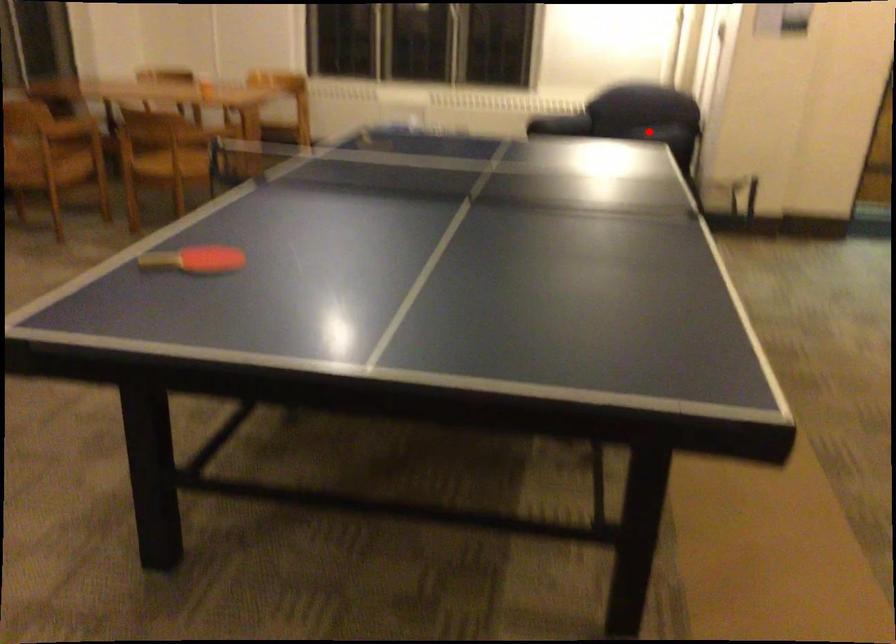
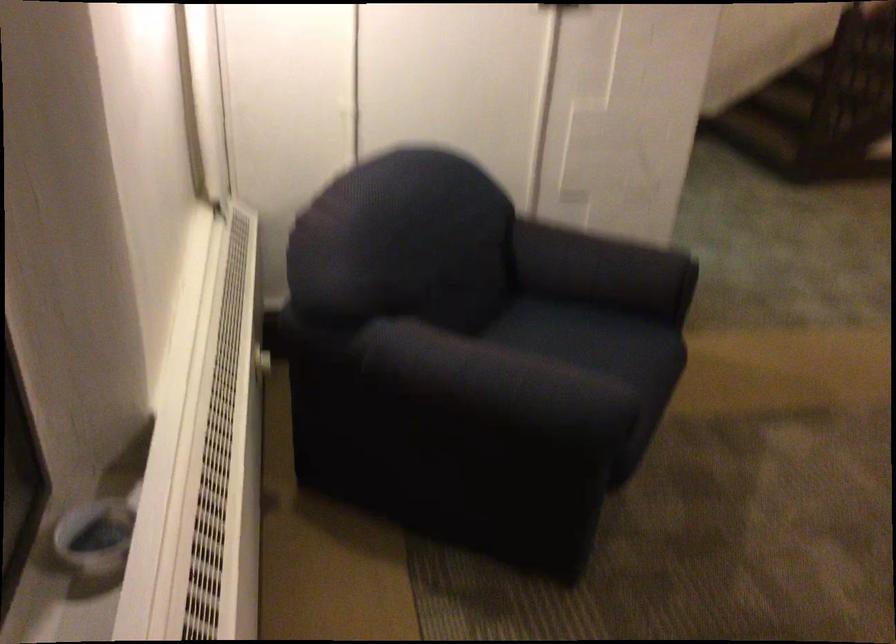
Find the pixel in the second image that matches the highlighted location in the first image.

(604, 270)